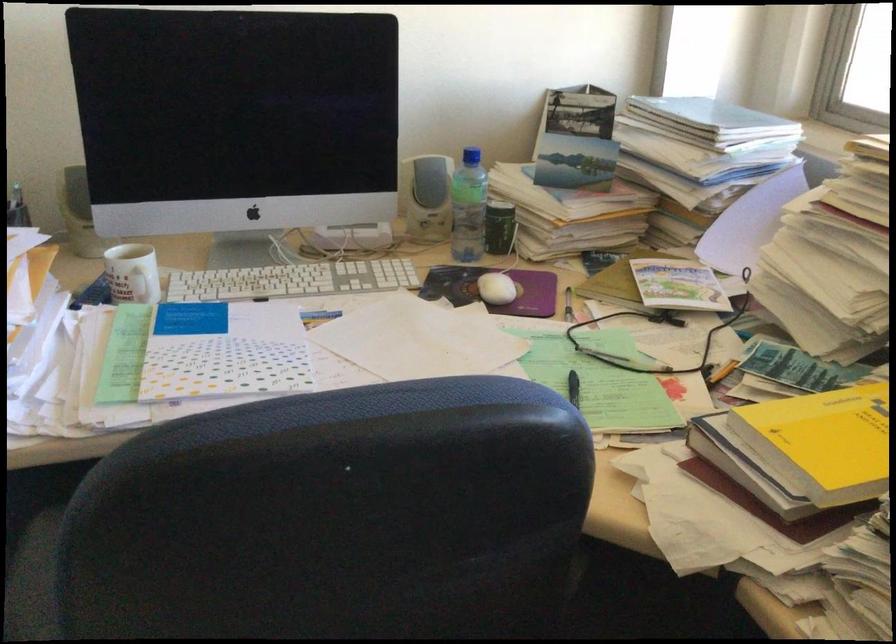
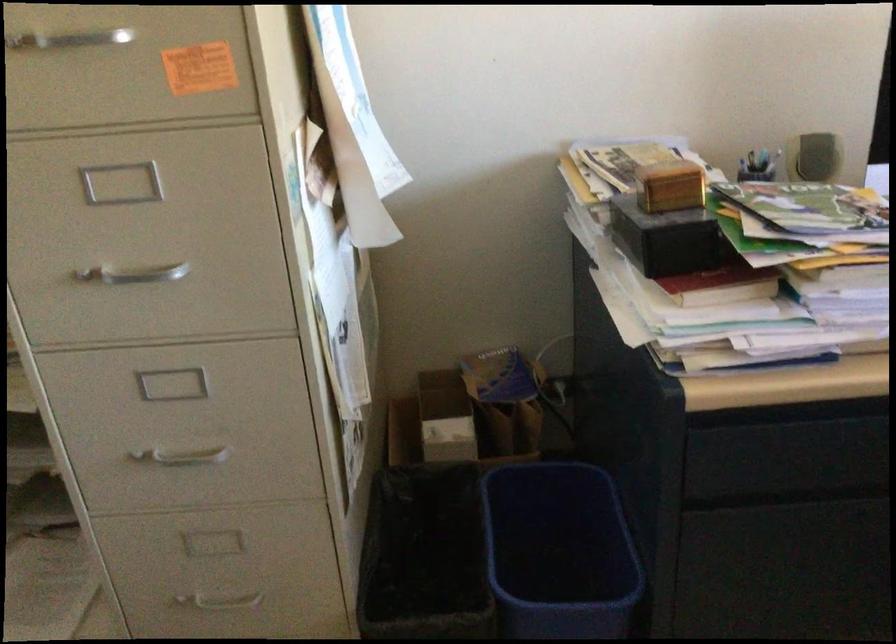
Question: The images are taken continuously from a first-person perspective. In which direction are you moving?

Choices:
 (A) Left
 (B) Right
 (C) Forward
 (D) Backward

Answer: (A)